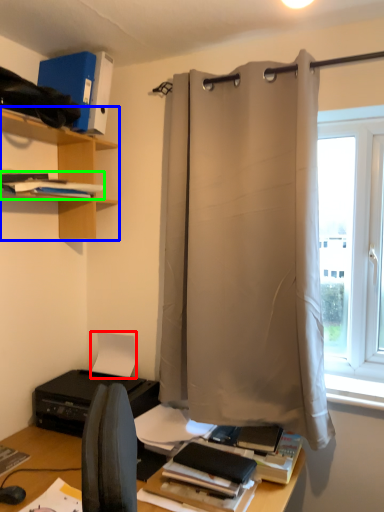
Question: Estimate the real-world distances between objects in this image. Which object is closer to paper (highlighted by a red box), shelf (highlighted by a blue box) or book (highlighted by a green box)?

Choices:
 (A) shelf
 (B) book

Answer: (A)